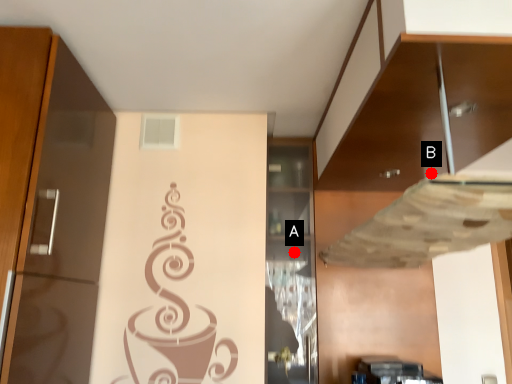
Question: Two points are circled on the image, labeled by A and B beside each circle. Among these points, which one is nearest to the camera?

Choices:
 (A) A is closer
 (B) B is closer

Answer: (B)